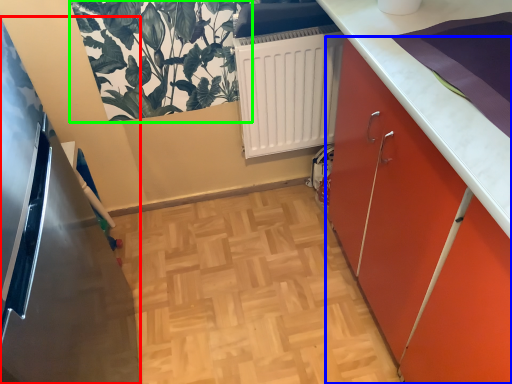
Question: Considering the real-world distances, which object is closest to appliance (highlighted by a red box)? cabinetry (highlighted by a blue box) or plant (highlighted by a green box).

Choices:
 (A) cabinetry
 (B) plant

Answer: (B)